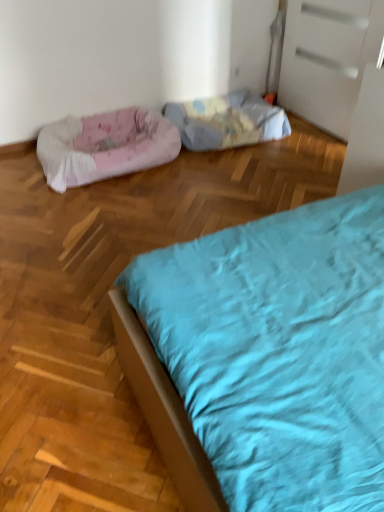
Where is `pink fabric dog bed at left, acting as the 1th dog bed starting from the left`? pink fabric dog bed at left, acting as the 1th dog bed starting from the left is located at coordinates (105, 146).

Describe the element at coordinates (105, 146) in the screenshot. I see `pink fabric dog bed at left, the 2th dog bed from the right` at that location.

Image resolution: width=384 pixels, height=512 pixels. Describe the element at coordinates (227, 121) in the screenshot. I see `fluffy fabric dog bed at center, placed as the first dog bed when sorted from right to left` at that location.

Locate an element on the screen. The image size is (384, 512). fluffy fabric dog bed at center, which ranks as the 2th dog bed in left-to-right order is located at coordinates (227, 121).

In order to face fluffy fabric dog bed at center, placed as the first dog bed when sorted from right to left, should I rotate leftwards or rightwards?

To face it directly, rotate right by 4.788 degrees.

Locate an element on the screen. This screenshot has width=384, height=512. pink fabric dog bed at left, acting as the 1th dog bed starting from the left is located at coordinates (105, 146).

Is fluffy fabric dog bed at center, which ranks as the 2th dog bed in left-to-right order, to the right of pink fabric dog bed at left, the 2th dog bed from the right, from the viewer's perspective?

Correct, you'll find fluffy fabric dog bed at center, which ranks as the 2th dog bed in left-to-right order, to the right of pink fabric dog bed at left, the 2th dog bed from the right.

Relative to pink fabric dog bed at left, the 2th dog bed from the right, is fluffy fabric dog bed at center, which ranks as the 2th dog bed in left-to-right order, in front or behind?

In the image, fluffy fabric dog bed at center, which ranks as the 2th dog bed in left-to-right order, appears behind pink fabric dog bed at left, the 2th dog bed from the right.

Is point (209, 122) farther from camera compared to point (45, 166)?

Yes.

From the image's perspective, is fluffy fabric dog bed at center, placed as the first dog bed when sorted from right to left, over pink fabric dog bed at left, the 2th dog bed from the right?

Yes, from the image's perspective, fluffy fabric dog bed at center, placed as the first dog bed when sorted from right to left, is on top of pink fabric dog bed at left, the 2th dog bed from the right.

From a real-world perspective, is fluffy fabric dog bed at center, placed as the first dog bed when sorted from right to left, beneath pink fabric dog bed at left, acting as the 1th dog bed starting from the left?

Yes, from a real-world perspective, fluffy fabric dog bed at center, placed as the first dog bed when sorted from right to left, is under pink fabric dog bed at left, acting as the 1th dog bed starting from the left.

Considering the relative sizes of fluffy fabric dog bed at center, which ranks as the 2th dog bed in left-to-right order, and pink fabric dog bed at left, the 2th dog bed from the right, in the image provided, is fluffy fabric dog bed at center, which ranks as the 2th dog bed in left-to-right order, wider than pink fabric dog bed at left, the 2th dog bed from the right,?

No, fluffy fabric dog bed at center, which ranks as the 2th dog bed in left-to-right order, is not wider than pink fabric dog bed at left, the 2th dog bed from the right.

Can you confirm if fluffy fabric dog bed at center, placed as the first dog bed when sorted from right to left, is shorter than pink fabric dog bed at left, acting as the 1th dog bed starting from the left?

Yes, fluffy fabric dog bed at center, placed as the first dog bed when sorted from right to left, is shorter than pink fabric dog bed at left, acting as the 1th dog bed starting from the left.

Can you confirm if fluffy fabric dog bed at center, placed as the first dog bed when sorted from right to left, is smaller than pink fabric dog bed at left, the 2th dog bed from the right?

Indeed, fluffy fabric dog bed at center, placed as the first dog bed when sorted from right to left, has a smaller size compared to pink fabric dog bed at left, the 2th dog bed from the right.

Would you say fluffy fabric dog bed at center, which ranks as the 2th dog bed in left-to-right order, is inside or outside pink fabric dog bed at left, the 2th dog bed from the right?

fluffy fabric dog bed at center, which ranks as the 2th dog bed in left-to-right order, exists outside the volume of pink fabric dog bed at left, the 2th dog bed from the right.

Are fluffy fabric dog bed at center, which ranks as the 2th dog bed in left-to-right order, and pink fabric dog bed at left, acting as the 1th dog bed starting from the left, making contact?

No, fluffy fabric dog bed at center, which ranks as the 2th dog bed in left-to-right order, is not touching pink fabric dog bed at left, acting as the 1th dog bed starting from the left.

Is pink fabric dog bed at left, the 2th dog bed from the right, at the back of fluffy fabric dog bed at center, placed as the first dog bed when sorted from right to left?

No, fluffy fabric dog bed at center, placed as the first dog bed when sorted from right to left,'s orientation is not away from pink fabric dog bed at left, the 2th dog bed from the right.

Can you tell me how much fluffy fabric dog bed at center, placed as the first dog bed when sorted from right to left, and pink fabric dog bed at left, acting as the 1th dog bed starting from the left, differ in facing direction?

The facing directions of fluffy fabric dog bed at center, placed as the first dog bed when sorted from right to left, and pink fabric dog bed at left, acting as the 1th dog bed starting from the left, are 3.88e-05 degrees apart.

Could you measure the distance between fluffy fabric dog bed at center, placed as the first dog bed when sorted from right to left, and pink fabric dog bed at left, acting as the 1th dog bed starting from the left?

21.31 inches.

Identify the location of dog bed that is on the left side of fluffy fabric dog bed at center, which ranks as the 2th dog bed in left-to-right order. This screenshot has height=512, width=384. (105, 146).

Is pink fabric dog bed at left, acting as the 1th dog bed starting from the left, at the left side of fluffy fabric dog bed at center, placed as the first dog bed when sorted from right to left?

Indeed, pink fabric dog bed at left, acting as the 1th dog bed starting from the left, is positioned on the left side of fluffy fabric dog bed at center, placed as the first dog bed when sorted from right to left.

Considering the positions of objects pink fabric dog bed at left, the 2th dog bed from the right, and fluffy fabric dog bed at center, which ranks as the 2th dog bed in left-to-right order, in the image provided, who is in front, pink fabric dog bed at left, the 2th dog bed from the right, or fluffy fabric dog bed at center, which ranks as the 2th dog bed in left-to-right order,?

pink fabric dog bed at left, the 2th dog bed from the right, is closer to the camera.

Which is nearer, (95, 173) or (226, 101)?

Point (95, 173) is positioned closer to the camera compared to point (226, 101).

From the image's perspective, relative to fluffy fabric dog bed at center, placed as the first dog bed when sorted from right to left, is pink fabric dog bed at left, the 2th dog bed from the right, above or below?

From the image's perspective, pink fabric dog bed at left, the 2th dog bed from the right, appears below fluffy fabric dog bed at center, placed as the first dog bed when sorted from right to left.

From a real-world perspective, which is physically above, pink fabric dog bed at left, acting as the 1th dog bed starting from the left, or fluffy fabric dog bed at center, which ranks as the 2th dog bed in left-to-right order?

In real-world perspective, pink fabric dog bed at left, acting as the 1th dog bed starting from the left, is above.

Between pink fabric dog bed at left, acting as the 1th dog bed starting from the left, and fluffy fabric dog bed at center, placed as the first dog bed when sorted from right to left, which one has smaller width?

fluffy fabric dog bed at center, placed as the first dog bed when sorted from right to left.

Does pink fabric dog bed at left, acting as the 1th dog bed starting from the left, have a greater height compared to fluffy fabric dog bed at center, which ranks as the 2th dog bed in left-to-right order?

Correct, pink fabric dog bed at left, acting as the 1th dog bed starting from the left, is much taller as fluffy fabric dog bed at center, which ranks as the 2th dog bed in left-to-right order.

In the scene shown: Considering the relative sizes of pink fabric dog bed at left, the 2th dog bed from the right, and fluffy fabric dog bed at center, which ranks as the 2th dog bed in left-to-right order, in the image provided, is pink fabric dog bed at left, the 2th dog bed from the right, bigger than fluffy fabric dog bed at center, which ranks as the 2th dog bed in left-to-right order,?

Yes.

Is fluffy fabric dog bed at center, placed as the first dog bed when sorted from right to left, completely or partially inside pink fabric dog bed at left, acting as the 1th dog bed starting from the left?

No, pink fabric dog bed at left, acting as the 1th dog bed starting from the left, does not contain fluffy fabric dog bed at center, placed as the first dog bed when sorted from right to left.

Are pink fabric dog bed at left, acting as the 1th dog bed starting from the left, and fluffy fabric dog bed at center, which ranks as the 2th dog bed in left-to-right order, making contact?

No, pink fabric dog bed at left, acting as the 1th dog bed starting from the left, is not making contact with fluffy fabric dog bed at center, which ranks as the 2th dog bed in left-to-right order.

Is pink fabric dog bed at left, the 2th dog bed from the right, facing away from fluffy fabric dog bed at center, which ranks as the 2th dog bed in left-to-right order?

No.

How many degrees apart are the facing directions of pink fabric dog bed at left, the 2th dog bed from the right, and fluffy fabric dog bed at center, which ranks as the 2th dog bed in left-to-right order?

There is a 3.88e-05-degree angle between the facing directions of pink fabric dog bed at left, the 2th dog bed from the right, and fluffy fabric dog bed at center, which ranks as the 2th dog bed in left-to-right order.

Where is `dog bed on the left of fluffy fabric dog bed at center, placed as the first dog bed when sorted from right to left`? This screenshot has width=384, height=512. dog bed on the left of fluffy fabric dog bed at center, placed as the first dog bed when sorted from right to left is located at coordinates (105, 146).

At what (x,y) coordinates should I click in order to perform the action: click on dog bed below the fluffy fabric dog bed at center, which ranks as the 2th dog bed in left-to-right order (from the image's perspective). Please return your answer as a coordinate pair (x, y). The height and width of the screenshot is (512, 384). Looking at the image, I should click on (105, 146).

Where is `dog bed on the right of pink fabric dog bed at left, acting as the 1th dog bed starting from the left`? This screenshot has height=512, width=384. dog bed on the right of pink fabric dog bed at left, acting as the 1th dog bed starting from the left is located at coordinates (227, 121).